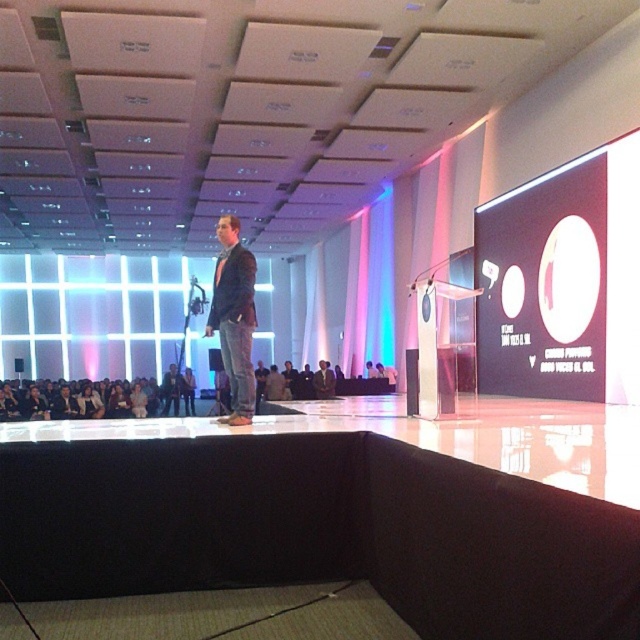
Which of these two, matte black circle at upper right or dark blue jeans at center, stands shorter?

dark blue jeans at center is shorter.

Between matte black circle at upper right and dark blue jeans at center, which one appears on the right side from the viewer's perspective?

matte black circle at upper right is more to the right.

At what (x,y) coordinates should I click in order to perform the action: click on matte black circle at upper right. Please return your answer as a coordinate pair (x, y). The height and width of the screenshot is (640, 640). Looking at the image, I should click on (563, 282).